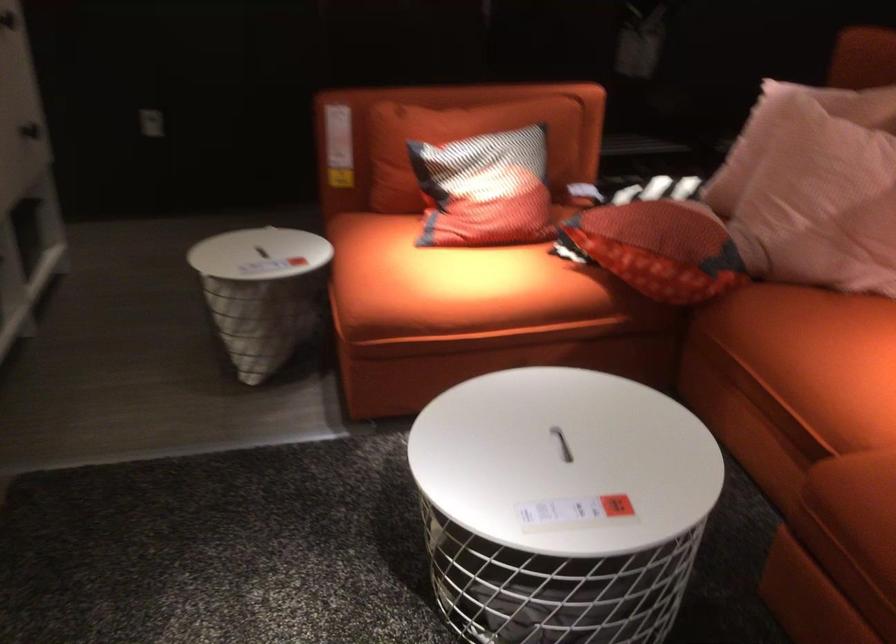
You are a GUI agent. You are given a task and a screenshot of the screen. Output one action in this format:
    pyautogui.click(x=<x>, y=<y>)
    Task: Click on the red patterned pillow
    The width and height of the screenshot is (896, 644).
    Given the screenshot: What is the action you would take?
    pyautogui.click(x=659, y=248)